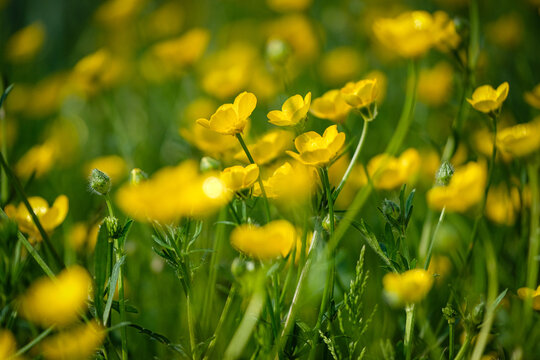
What are the coordinates of `top-left-most  flower` in the screenshot? It's located at (36, 43).